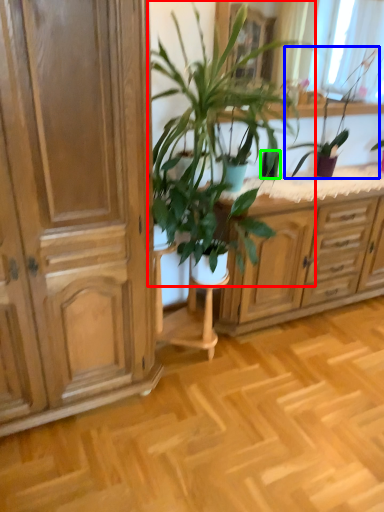
Question: Considering the real-world distances, which object is closest to houseplant (highlighted by a red box)? houseplant (highlighted by a blue box) or flowerpot (highlighted by a green box).

Choices:
 (A) houseplant
 (B) flowerpot

Answer: (B)